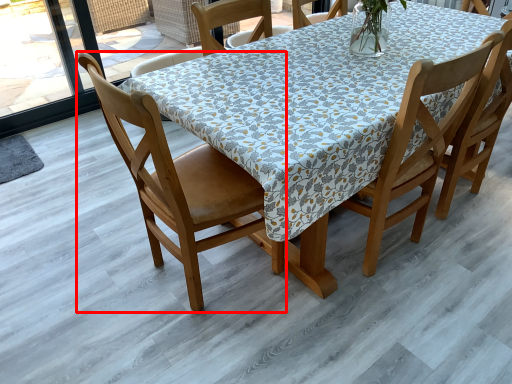
Question: In this image, where is chair (annotated by the red box) located relative to chair?

Choices:
 (A) right
 (B) left

Answer: (B)